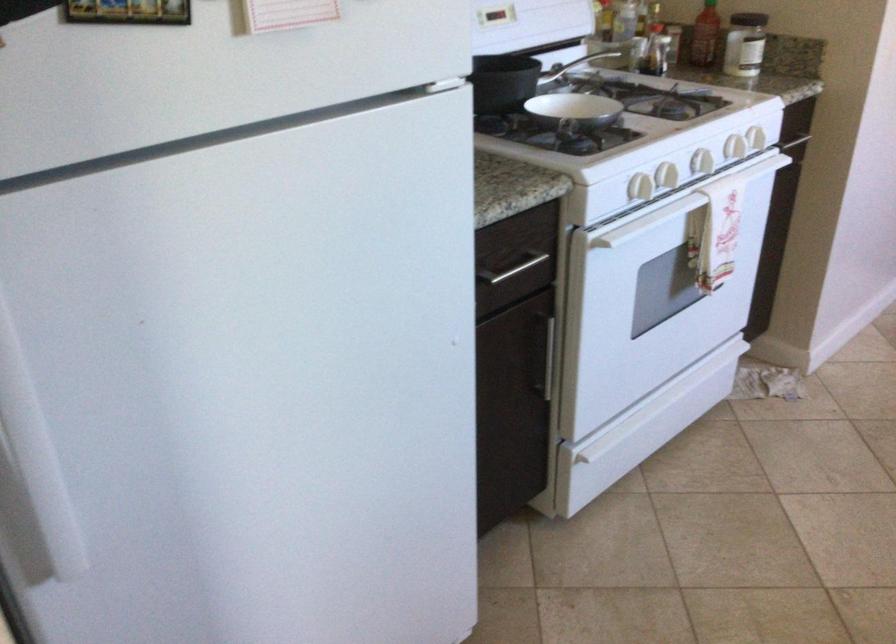
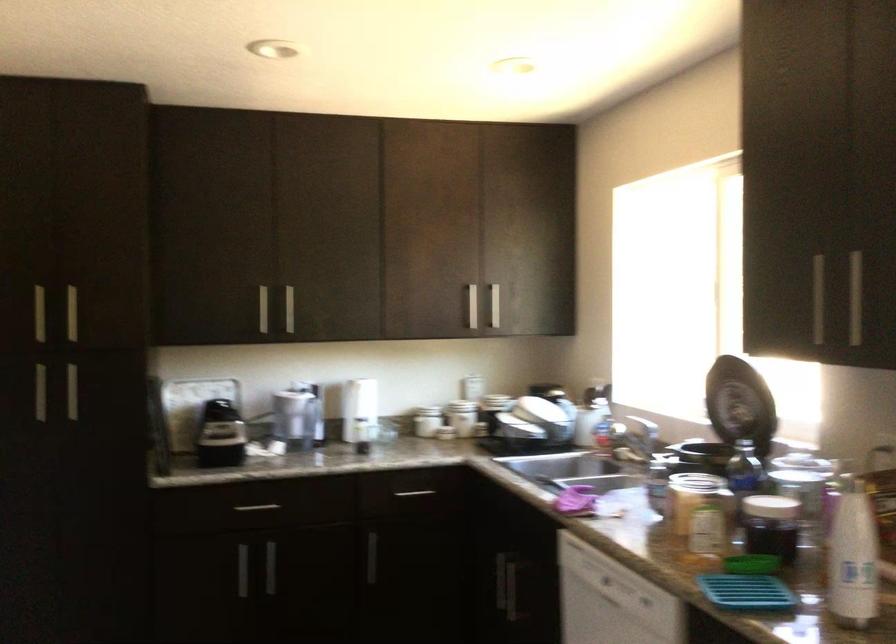
Question: The camera is either moving clockwise (left) or counter-clockwise (right) around the object. The first image is from the beginning of the video and the second image is from the end. Is the camera moving left or right when shooting the video?

Choices:
 (A) Left
 (B) Right

Answer: (A)